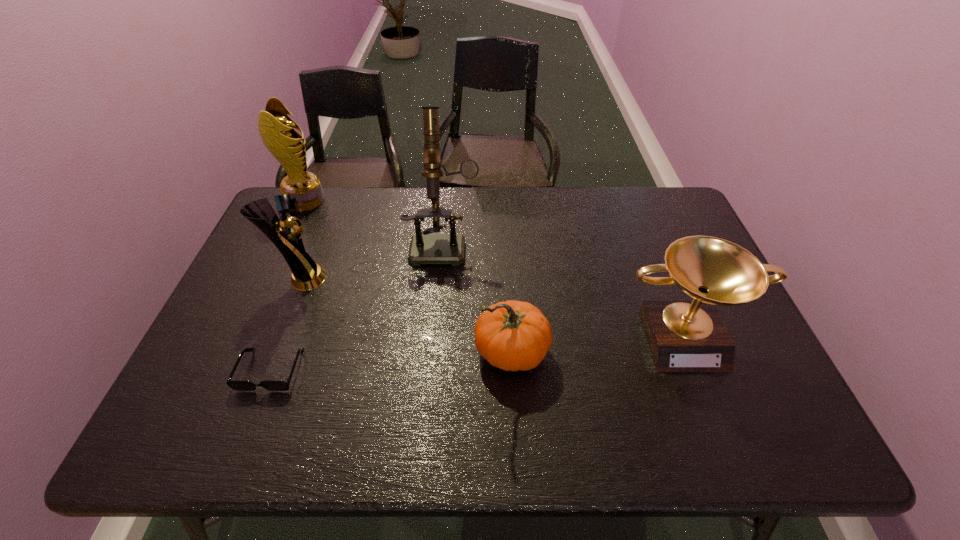
Identify the location of vacant region located at the front of the second nearest award, where the globe is visible. (358, 279).

Identify the location of vacant area located 0.080m on the left of the pumpkin. (443, 353).

Locate an element on the screen. vacant area located 0.110m on the front-facing side of the shortest award is located at coordinates (713, 415).

Locate an element on the screen. The height and width of the screenshot is (540, 960). free region located on the front-facing side of the shortest object is located at coordinates (251, 422).

I want to click on microscope that is at the far edge, so click(425, 248).

This screenshot has width=960, height=540. Identify the location of award that is positioned at the far edge. (276, 129).

Locate an element on the screen. sunglasses present at the left edge is located at coordinates (239, 385).

Image resolution: width=960 pixels, height=540 pixels. Identify the location of object that is at the right edge. coord(683,336).

Image resolution: width=960 pixels, height=540 pixels. Identify the location of object that is at the far left corner. (276, 129).

The width and height of the screenshot is (960, 540). Find the location of `vacant area at the far edge`. vacant area at the far edge is located at coordinates (362, 192).